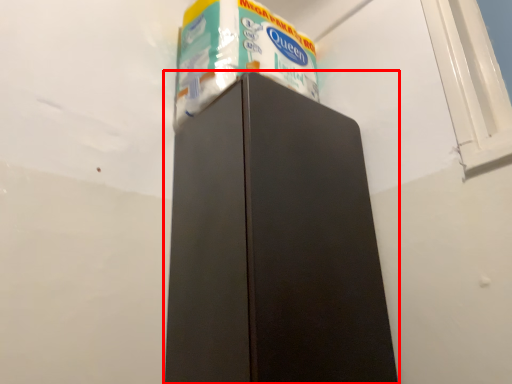
Question: From the image's perspective, what is the correct spatial relationship of refrigerator (annotated by the red box) in relation to toilet paper?

Choices:
 (A) below
 (B) above

Answer: (A)